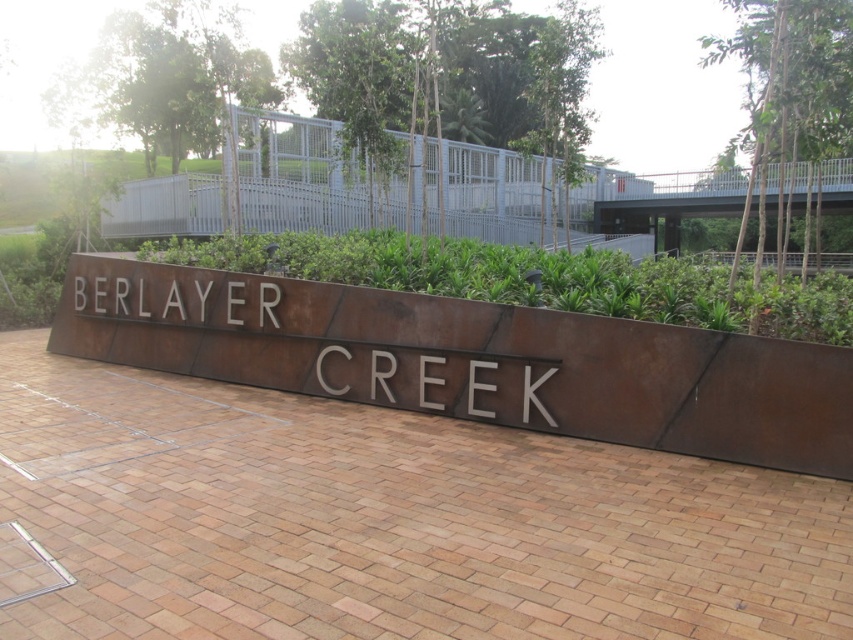
Question: Which point is farther from the camera taking this photo?

Choices:
 (A) (325, 339)
 (B) (734, 326)

Answer: (A)

Question: Can you confirm if rusty metal sign at center is positioned to the left of green leafy plants at center?

Choices:
 (A) yes
 (B) no

Answer: (A)

Question: Does rusty metal sign at center have a lesser width compared to green leafy plants at center?

Choices:
 (A) yes
 (B) no

Answer: (A)

Question: Which object appears closest to the camera in this image?

Choices:
 (A) rusty metal sign at center
 (B) green leafy plants at center

Answer: (B)

Question: Is rusty metal sign at center wider than green leafy plants at center?

Choices:
 (A) yes
 (B) no

Answer: (B)